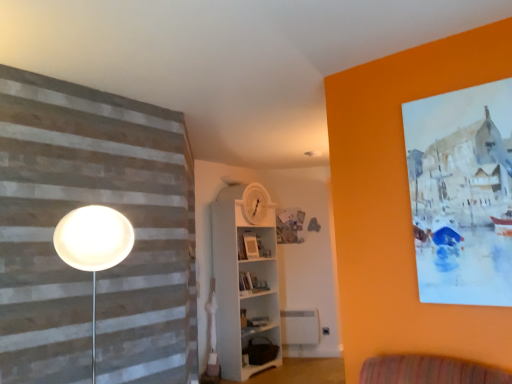
Question: Based on their sizes in the image, would you say brown fabric bag at lower center, which appears as the 2th shelf when viewed from the top, is bigger or smaller than white wooden shelf at center, which is counted as the first shelf, starting from the top?

Choices:
 (A) big
 (B) small

Answer: (B)

Question: In the image, is brown fabric bag at lower center, marked as the first shelf in a bottom-to-top arrangement, positioned in front of or behind white wooden shelf at center, which is counted as the first shelf, starting from the top?

Choices:
 (A) front
 (B) behind

Answer: (B)

Question: Based on their relative distances, which object is farther from the matte white picture frame at center?

Choices:
 (A) brown fabric bag at lower center, marked as the first shelf in a bottom-to-top arrangement
 (B) white wooden shelf at center, which is counted as the first shelf, starting from the top

Answer: (A)

Question: Based on their relative distances, which object is farther from the white wooden shelf at center, which is counted as the first shelf, starting from the top?

Choices:
 (A) brown fabric bag at lower center, which appears as the 2th shelf when viewed from the top
 (B) matte white picture frame at center

Answer: (B)